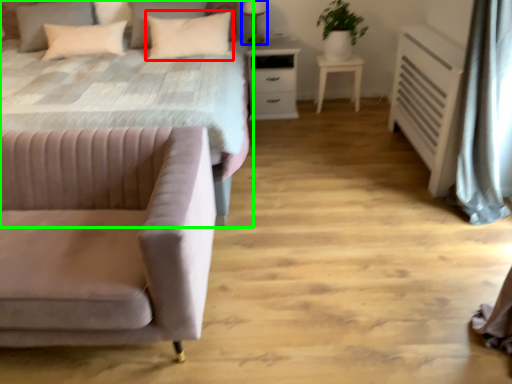
Question: Estimate the real-world distances between objects in this image. Which object is closer to pillow (highlighted by a red box), table lamp (highlighted by a blue box) or bed (highlighted by a green box)?

Choices:
 (A) table lamp
 (B) bed

Answer: (A)